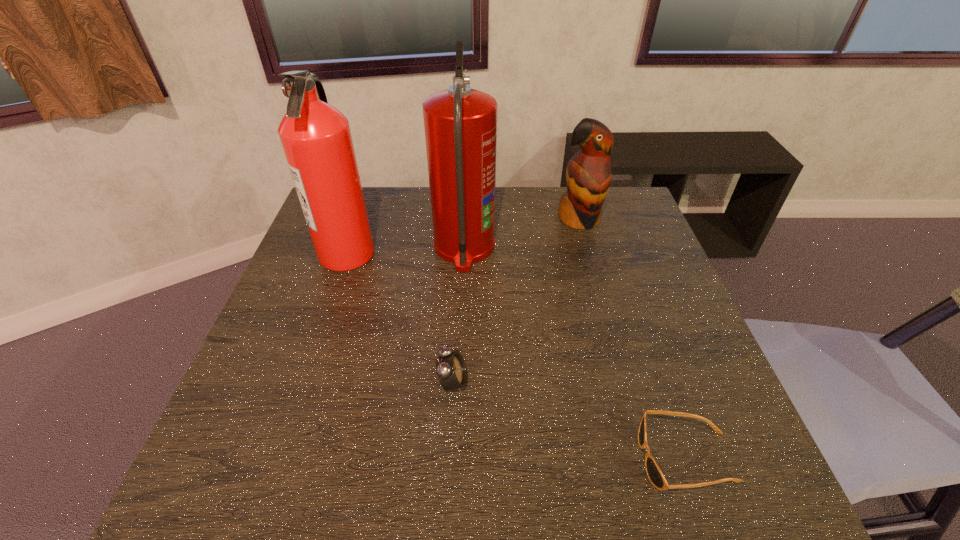
Where is `object at the far right corner`? This screenshot has height=540, width=960. object at the far right corner is located at coordinates (588, 175).

You are a GUI agent. You are given a task and a screenshot of the screen. Output one action in this format:
    pyautogui.click(x=<x>, y=<y>)
    Task: Click on the object that is at the near right corner
    This screenshot has width=960, height=540.
    Given the screenshot: What is the action you would take?
    pyautogui.click(x=653, y=471)

Locate an element on the screen. The height and width of the screenshot is (540, 960). vacant space at the far edge of the desktop is located at coordinates (422, 212).

Identify the location of free space at the near edge of the desktop. (640, 465).

This screenshot has height=540, width=960. What are the coordinates of `vacant space at the left edge of the desktop` in the screenshot? It's located at (245, 422).

Image resolution: width=960 pixels, height=540 pixels. I want to click on vacant space at the right edge of the desktop, so click(668, 295).

Where is `vacant area at the near left corner of the desktop`? Image resolution: width=960 pixels, height=540 pixels. vacant area at the near left corner of the desktop is located at coordinates (211, 461).

Find the location of a particular element. vacant point located between the third shortest object and the right fire extinguisher is located at coordinates (521, 233).

At what (x,y) coordinates should I click in order to perform the action: click on empty location between the right fire extinguisher and the leftmost object. Please return your answer as a coordinate pair (x, y). The image size is (960, 540). Looking at the image, I should click on (406, 250).

Find the location of a particular element. This screenshot has width=960, height=540. free space that is in between the fourth tallest object and the nearest object is located at coordinates (569, 420).